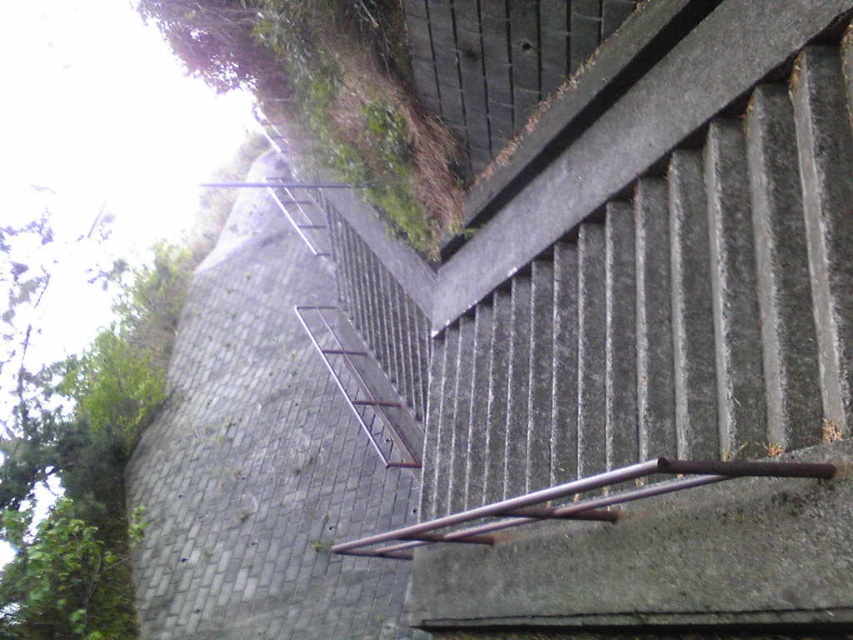
Looking at this image, between gray concrete wall at upper left and rusty metal rail at center, which one has more height?

rusty metal rail at center

Where is `gray concrete wall at upper left`? This screenshot has width=853, height=640. gray concrete wall at upper left is located at coordinates (x=262, y=458).

Locate an element on the screen. The image size is (853, 640). gray concrete wall at upper left is located at coordinates (262, 458).